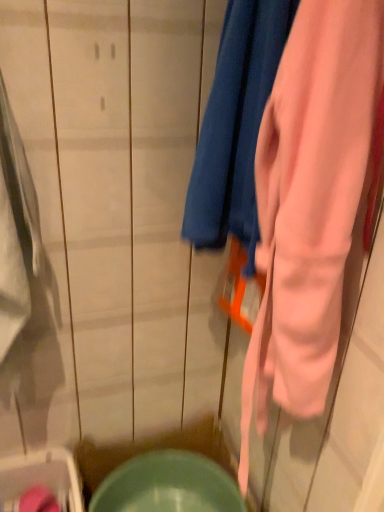
Question: Can you confirm if matte green bowl at lower center is bigger than pink soft fabric towel at center?

Choices:
 (A) yes
 (B) no

Answer: (B)

Question: Considering the relative sizes of matte green bowl at lower center and pink soft fabric towel at center in the image provided, is matte green bowl at lower center thinner than pink soft fabric towel at center?

Choices:
 (A) yes
 (B) no

Answer: (B)

Question: Is matte green bowl at lower center touching pink soft fabric towel at center?

Choices:
 (A) yes
 (B) no

Answer: (B)

Question: From a real-world perspective, is matte green bowl at lower center beneath pink soft fabric towel at center?

Choices:
 (A) yes
 (B) no

Answer: (A)

Question: Does matte green bowl at lower center have a smaller size compared to pink soft fabric towel at center?

Choices:
 (A) no
 (B) yes

Answer: (B)

Question: Is matte green bowl at lower center taller than pink soft fabric towel at center?

Choices:
 (A) yes
 (B) no

Answer: (B)

Question: Does pink soft fabric towel at center have a larger size compared to matte green bowl at lower center?

Choices:
 (A) no
 (B) yes

Answer: (B)

Question: Does pink soft fabric towel at center have a lesser height compared to matte green bowl at lower center?

Choices:
 (A) yes
 (B) no

Answer: (B)

Question: From the image's perspective, is pink soft fabric towel at center under matte green bowl at lower center?

Choices:
 (A) no
 (B) yes

Answer: (A)

Question: Is pink soft fabric towel at center not inside matte green bowl at lower center?

Choices:
 (A) yes
 (B) no

Answer: (A)

Question: Considering the relative positions of pink soft fabric towel at center and matte green bowl at lower center in the image provided, is pink soft fabric towel at center to the right of matte green bowl at lower center from the viewer's perspective?

Choices:
 (A) no
 (B) yes

Answer: (B)

Question: From the image's perspective, would you say pink soft fabric towel at center is positioned over matte green bowl at lower center?

Choices:
 (A) yes
 (B) no

Answer: (A)

Question: Would you say matte green plastic washer at lower left is a long distance from matte green bowl at lower center?

Choices:
 (A) no
 (B) yes

Answer: (A)